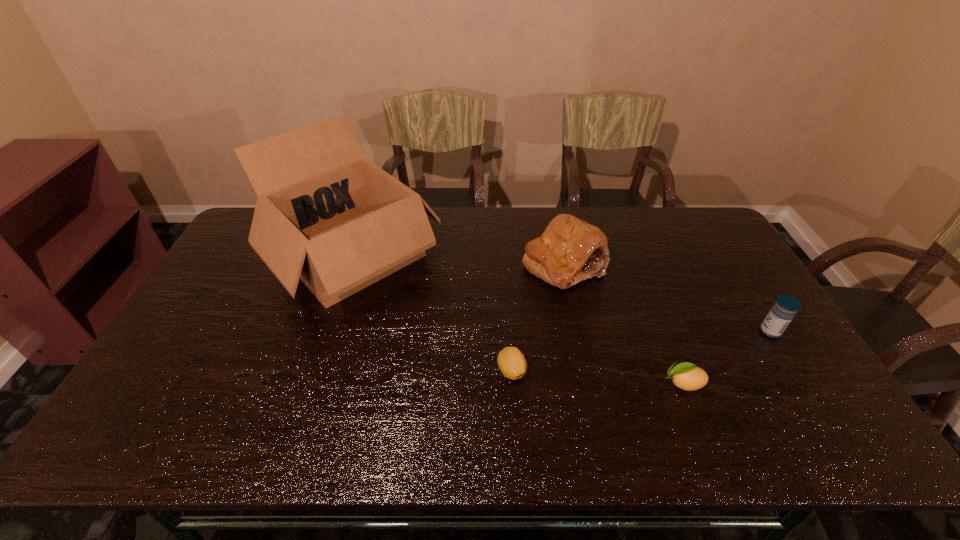
Find the location of a particular element. the leftmost object is located at coordinates (325, 214).

Identify the location of box. (325, 214).

The image size is (960, 540). Identify the location of bread. (570, 250).

Locate an element on the screen. The height and width of the screenshot is (540, 960). the third object from left to right is located at coordinates (570, 250).

The image size is (960, 540). Find the location of `the third tallest object`. the third tallest object is located at coordinates (783, 311).

The image size is (960, 540). Identify the location of the rightmost object. (783, 311).

Find the location of a particular element. the right lemon is located at coordinates (687, 376).

This screenshot has width=960, height=540. In order to click on the fourth object from right to left in this screenshot , I will do `click(512, 363)`.

You are a GUI agent. You are given a task and a screenshot of the screen. Output one action in this format:
    pyautogui.click(x=<x>, y=<y>)
    Task: Click on the free space located 0.100m on the left of the leftmost object
    
    Given the screenshot: What is the action you would take?
    pyautogui.click(x=236, y=256)

The height and width of the screenshot is (540, 960). In order to click on vacant area situated on the filling side of the third object from right to left in this screenshot , I will do `click(576, 325)`.